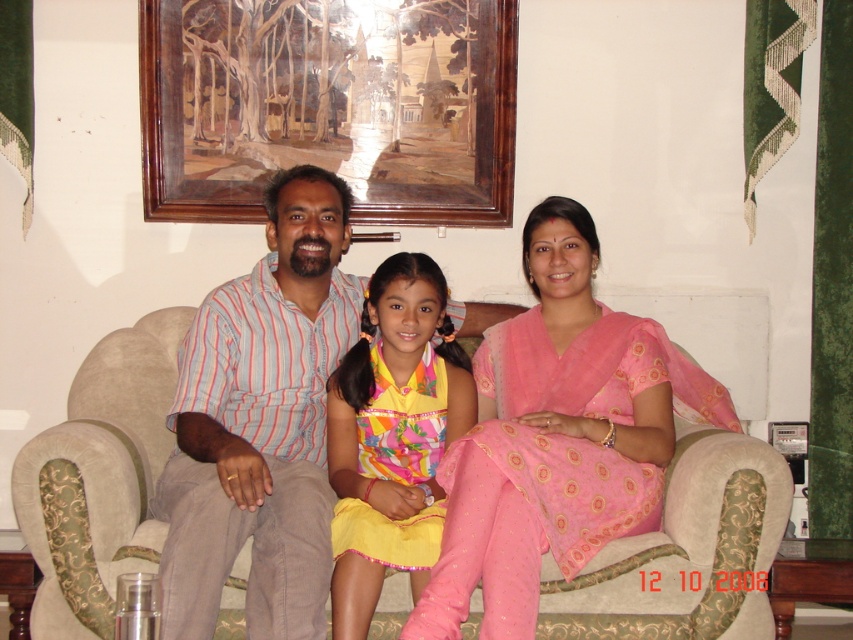
Question: Which object appears farthest from the camera in this image?

Choices:
 (A) pink satin saree at center
 (B) beige fabric couch at center

Answer: (B)

Question: Which of the following is the closest to the observer?

Choices:
 (A) beige fabric couch at center
 (B) striped cotton shirt at center

Answer: (B)

Question: Is wooden picture frame at upper center closer to the viewer compared to vibrant cotton dress at center?

Choices:
 (A) yes
 (B) no

Answer: (B)

Question: Which of the following is the closest to the observer?

Choices:
 (A) (165, 314)
 (B) (622, 465)

Answer: (B)

Question: Can you confirm if wooden picture frame at upper center is thinner than beige fabric couch at center?

Choices:
 (A) yes
 (B) no

Answer: (B)

Question: Does beige fabric couch at center have a smaller size compared to vibrant cotton dress at center?

Choices:
 (A) no
 (B) yes

Answer: (A)